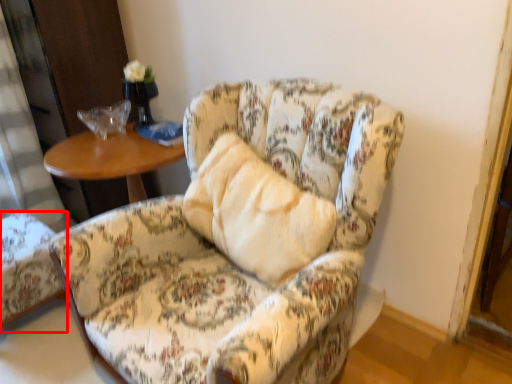
Question: From the image's perspective, where is chair (annotated by the red box) located relative to chair?

Choices:
 (A) below
 (B) above

Answer: (A)